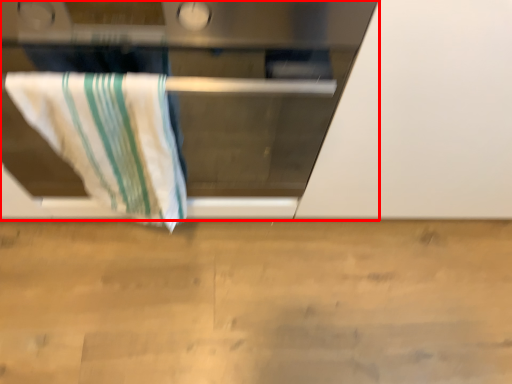
Question: Considering the relative positions of oven (annotated by the red box) and towel in the image provided, where is oven (annotated by the red box) located with respect to the staircase?

Choices:
 (A) left
 (B) right

Answer: (B)